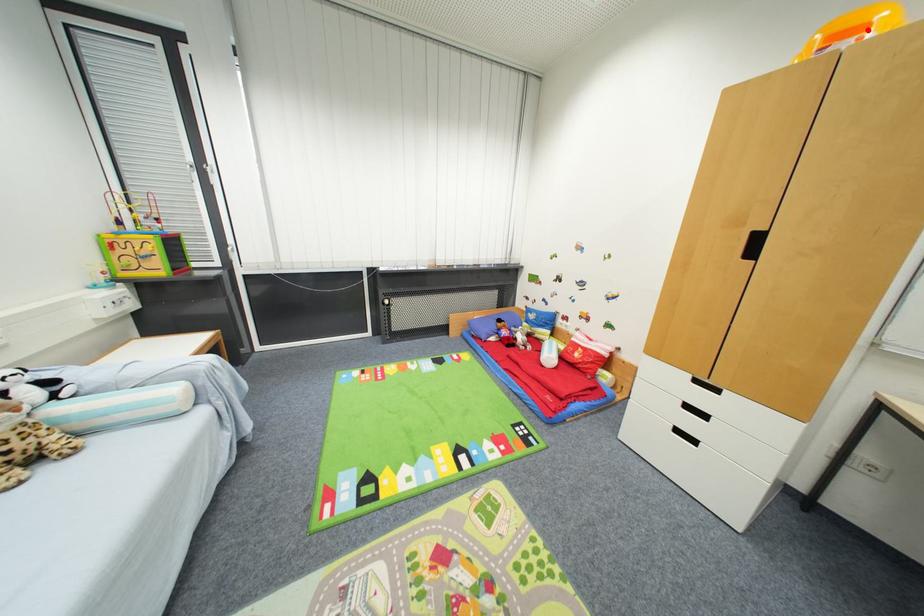
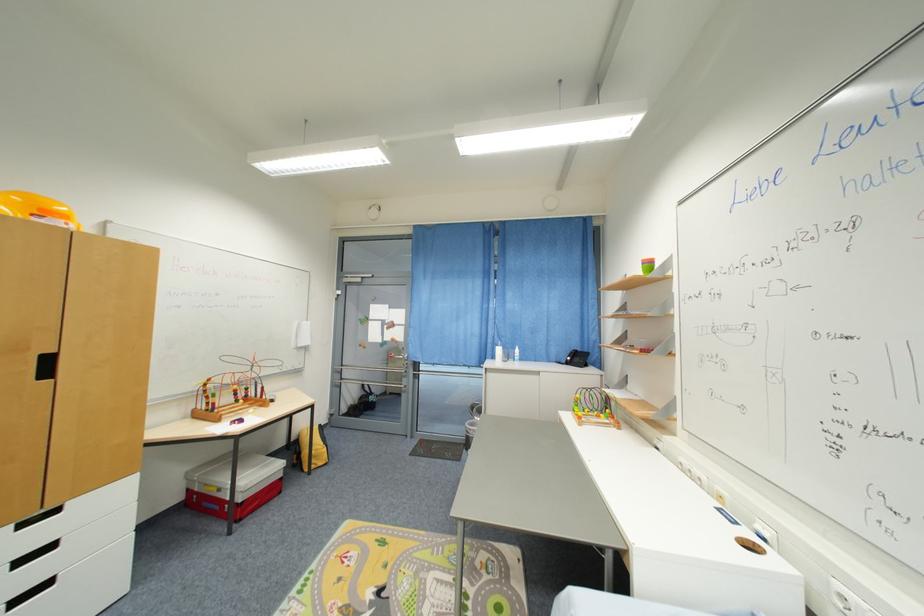
Question: I am providing you with two images of the same scene from different viewpoints. In image1, a red point is highlighted. Considering the same 3D point in image2, which of the following is correct?

Choices:
 (A) It is closer
 (B) It is farther

Answer: (A)